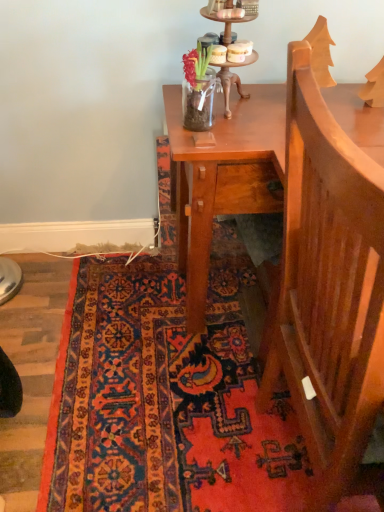
Identify the location of free location above carpet with intricate patterns at lower center (from a real-world perspective). The height and width of the screenshot is (512, 384). (118, 379).